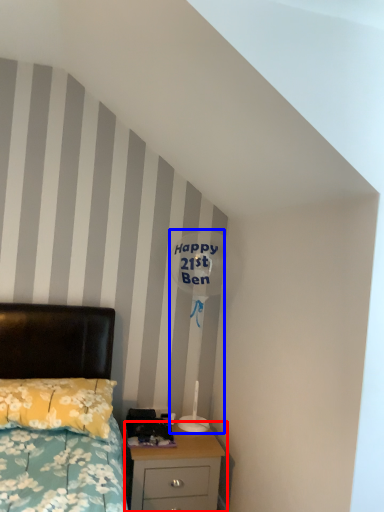
Question: Which of the following is the farthest to the observer, nightstand (highlighted by a red box) or table lamp (highlighted by a blue box)?

Choices:
 (A) nightstand
 (B) table lamp

Answer: (B)